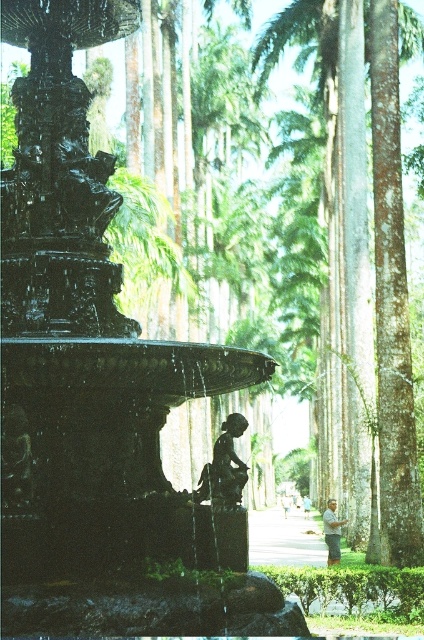
Can you confirm if light brown wooden bench at center is positioned to the left of light blue fabric shirt at center?

Correct, you'll find light brown wooden bench at center to the left of light blue fabric shirt at center.

At what (x,y) coordinates should I click in order to perform the action: click on light brown wooden bench at center. Please return your answer as a coordinate pair (x, y). Looking at the image, I should click on (286, 504).

Which of these two, green textured palm tree at center or light brown wood pole at lower right, stands taller?

green textured palm tree at center is taller.

Does green textured palm tree at center appear on the left side of light brown wood pole at lower right?

No, green textured palm tree at center is not to the left of light brown wood pole at lower right.

Does point (398, 380) lie in front of point (337, 552)?

Yes, it is.

This screenshot has width=424, height=640. In order to click on green textured palm tree at center in this screenshot , I will do `click(393, 289)`.

Is green textured palm tree at center wider than light blue fabric shirt at center?

Yes.

Is green textured palm tree at center below light blue fabric shirt at center?

Incorrect, green textured palm tree at center is not positioned below light blue fabric shirt at center.

At what (x,y) coordinates should I click in order to perform the action: click on green textured palm tree at center. Please return your answer as a coordinate pair (x, y). The height and width of the screenshot is (640, 424). Looking at the image, I should click on (393, 289).